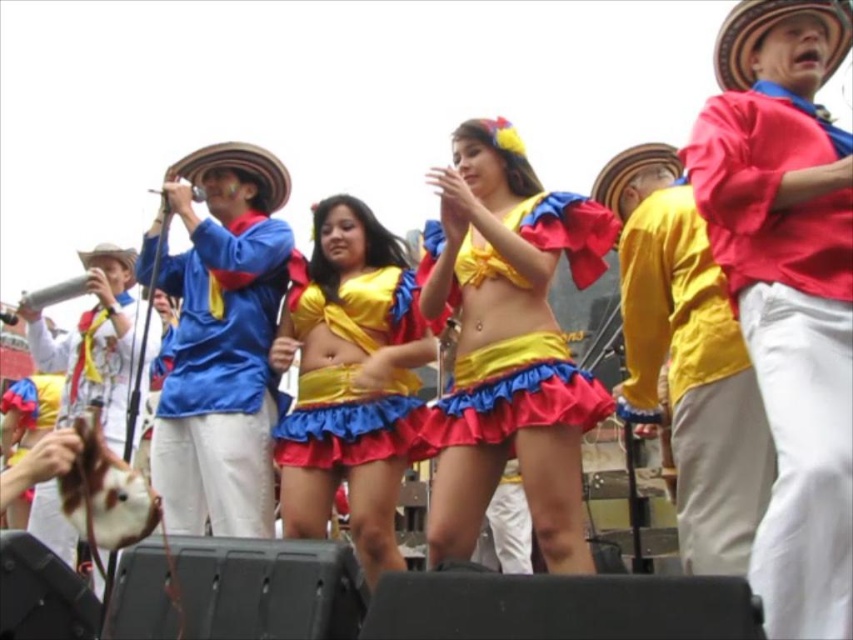
The height and width of the screenshot is (640, 853). What do you see at coordinates (788, 337) in the screenshot?
I see `red cotton shirt at right` at bounding box center [788, 337].

Measure the distance between red cotton shirt at right and shiny satin skirt at center.

red cotton shirt at right and shiny satin skirt at center are 20.09 meters apart from each other.

Identify the location of red cotton shirt at right. The image size is (853, 640). (788, 337).

This screenshot has width=853, height=640. I want to click on red cotton shirt at right, so click(788, 337).

Which is above, shiny satin dress at center or matte blue shirt at left?

Positioned higher is shiny satin dress at center.

Is shiny satin dress at center above matte blue shirt at left?

Yes.

Is point (288, 484) behind point (241, 339)?

No, (288, 484) is closer to viewer.

At what (x,y) coordinates should I click in order to perform the action: click on shiny satin dress at center. Please return your answer as a coordinate pair (x, y). This screenshot has height=640, width=853. Looking at the image, I should click on (350, 381).

Is red cotton shirt at right positioned at the back of yellow satin bikini top at center?

No, it is not.

At what (x,y) coordinates should I click in order to perform the action: click on red cotton shirt at right. Please return your answer as a coordinate pair (x, y). This screenshot has width=853, height=640. Looking at the image, I should click on pyautogui.click(x=788, y=337).

Is point (782, 589) more distant than point (347, 433)?

No, (782, 589) is closer to viewer.

Where is `red cotton shirt at right`? The height and width of the screenshot is (640, 853). red cotton shirt at right is located at coordinates (788, 337).